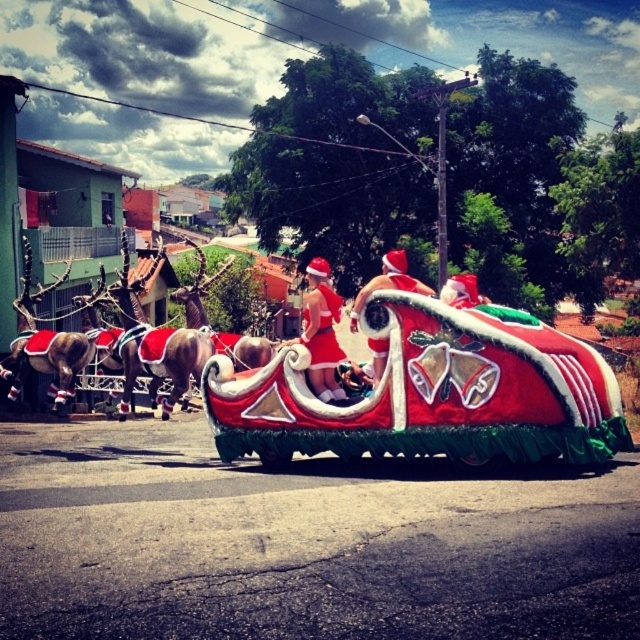
You are a photographer taking a picture of the festive float. You notice both the red velvet dress at center and the red velvet santa hat at center. Which object should you focus on first if you want to capture the one that is lower in the image?

The red velvet dress at center is located below the red velvet santa hat at center, so you should focus on the red velvet dress at center first as it is lower in the image.